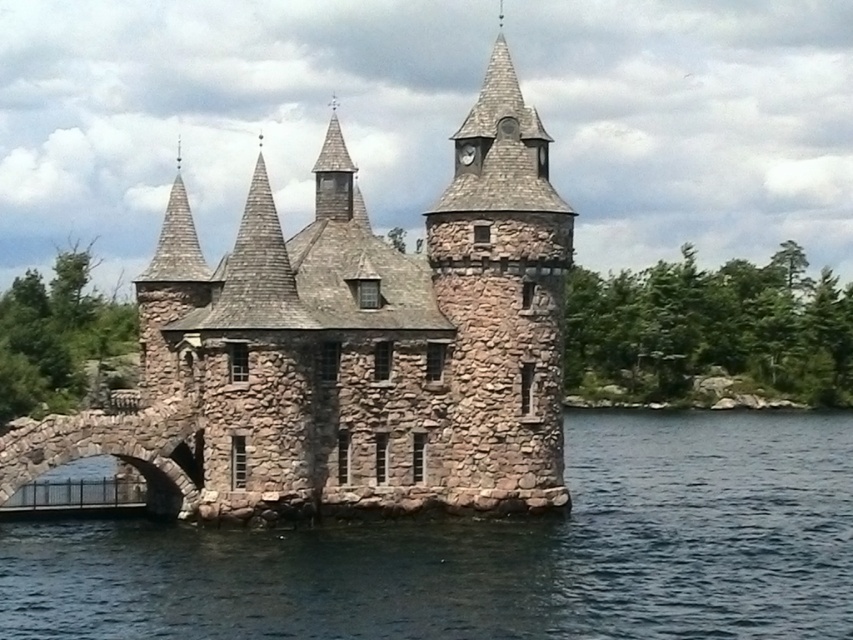
Question: Considering the real-world distances, which object is closest to the stone arched bridge at lower left?

Choices:
 (A) clear blue water at lower center
 (B) rustic stone tower at center

Answer: (B)

Question: Which point is farther from the camera taking this photo?

Choices:
 (A) (347, 502)
 (B) (566, 252)
 (C) (799, 588)
 (D) (114, 424)

Answer: (B)

Question: From the image, what is the correct spatial relationship of clear blue water at lower center in relation to rustic stone tower at center?

Choices:
 (A) left
 (B) right

Answer: (A)

Question: Which point is closer to the camera?

Choices:
 (A) clear blue water at lower center
 (B) stone arched bridge at lower left
 (C) rustic stone tower at center

Answer: (A)

Question: Considering the relative positions of clear blue water at lower center and rustic stone tower at center in the image provided, where is clear blue water at lower center located with respect to rustic stone tower at center?

Choices:
 (A) left
 (B) right

Answer: (A)

Question: Can you confirm if clear blue water at lower center is positioned to the right of stone arched bridge at lower left?

Choices:
 (A) no
 (B) yes

Answer: (B)